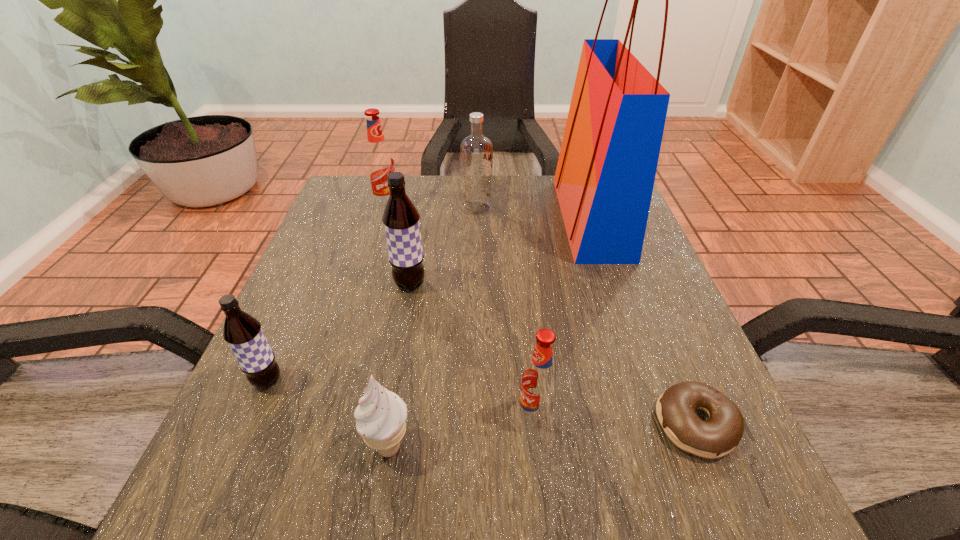
Find the location of a particular element. free point between the fourth object from right to left and the smaller red root beer is located at coordinates (506, 312).

This screenshot has height=540, width=960. I want to click on free point between the fifth object from left to right and the nearer brown root beer, so click(x=372, y=295).

Find the location of a particular element. vacant region between the vodka and the blue shopping bag is located at coordinates (534, 213).

This screenshot has width=960, height=540. I want to click on vacant space that is in between the third farthest root beer and the bigger brown root beer, so click(x=339, y=332).

Locate an element on the screen. Image resolution: width=960 pixels, height=540 pixels. vacant area that lies between the bigger red root beer and the third object from right to left is located at coordinates (461, 310).

At what (x,y) coordinates should I click in order to perform the action: click on empty space between the blue shopping bag and the icecream. Please return your answer as a coordinate pair (x, y). Looking at the image, I should click on (490, 333).

At what (x,y) coordinates should I click in order to perform the action: click on empty space between the fifth nearest object and the shopping bag. Please return your answer as a coordinate pair (x, y). Image resolution: width=960 pixels, height=540 pixels. Looking at the image, I should click on (500, 251).

The height and width of the screenshot is (540, 960). I want to click on object that is the seventh closest to the blue shopping bag, so click(243, 333).

You are a GUI agent. You are given a task and a screenshot of the screen. Output one action in this format:
    pyautogui.click(x=<x>, y=<y>)
    Task: Click on the fifth closest object to the fourth object from right to left
    The width and height of the screenshot is (960, 540).
    Given the screenshot: What is the action you would take?
    pyautogui.click(x=243, y=333)

Locate an element on the screen. the closest root beer relative to the vodka is located at coordinates (379, 161).